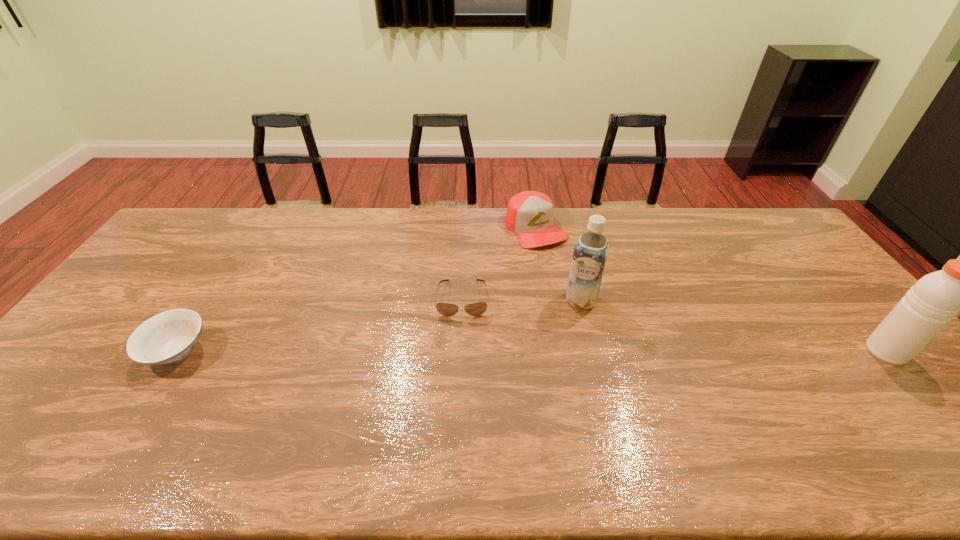
What are the coordinates of `vacant space in between the sunglasses and the rightmost object` in the screenshot? It's located at (675, 325).

This screenshot has height=540, width=960. Find the location of `free spot between the fourth tallest object and the soya milk`. free spot between the fourth tallest object and the soya milk is located at coordinates (379, 326).

Where is `free point between the shaker and the leftmost object`? free point between the shaker and the leftmost object is located at coordinates (532, 351).

What are the coordinates of `free space between the shaker and the sunglasses` in the screenshot? It's located at (675, 325).

What are the coordinates of `free area in between the baseball cap and the soya milk` in the screenshot? It's located at (559, 264).

What are the coordinates of `free space between the leftmost object and the second object from left to right` in the screenshot? It's located at (x=320, y=325).

You are a GUI agent. You are given a task and a screenshot of the screen. Output one action in this format:
    pyautogui.click(x=<x>, y=<y>)
    Task: Click on the empty space between the soya milk and the baseball cap
    The width and height of the screenshot is (960, 540).
    Given the screenshot: What is the action you would take?
    pyautogui.click(x=559, y=264)

Identify the location of object identified as the second closest to the leftmost object. (530, 214).

Point out which object is positioned as the fourth nearest to the fourth object from right to left. Please provide its 2D coordinates. Your answer should be formatted as a tuple, i.e. [(x, y)], where the tuple contains the x and y coordinates of a point satisfying the conditions above.

[(929, 305)]

This screenshot has width=960, height=540. Find the location of `vacant space that satisfies the following two spatial constraints: 1. on the front side of the shortest object; 2. on the right side of the soya milk`. vacant space that satisfies the following two spatial constraints: 1. on the front side of the shortest object; 2. on the right side of the soya milk is located at coordinates pyautogui.click(x=463, y=300).